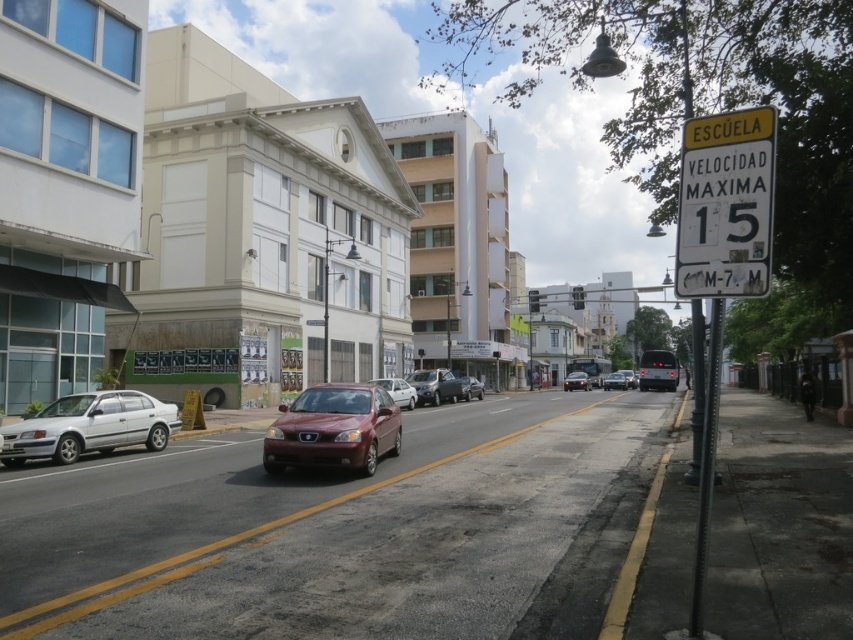
Question: Which is farther from the white matte car at center?

Choices:
 (A) matte red car at center
 (B) satin silver sedan at center
 (C) silver metallic sedan at left
 (D) matte black sedan at center

Answer: (D)

Question: Can you confirm if satin red sedan at center is smaller than white matte car at center?

Choices:
 (A) no
 (B) yes

Answer: (A)

Question: Is satin red sedan at center to the right of white matte car at center from the viewer's perspective?

Choices:
 (A) no
 (B) yes

Answer: (A)

Question: Is satin silver sedan at center wider than matte black sedan at center?

Choices:
 (A) yes
 (B) no

Answer: (B)

Question: Estimate the real-world distances between objects in this image. Which object is closer to the silver metallic sedan at left?

Choices:
 (A) satin silver sedan at center
 (B) matte black sedan at center
 (C) matte red sedan at center

Answer: (A)

Question: Based on their relative distances, which object is farther from the yellow metallic sign at upper right?

Choices:
 (A) matte red sedan at center
 (B) matte black sedan at center
 (C) silver metallic sedan at left

Answer: (B)